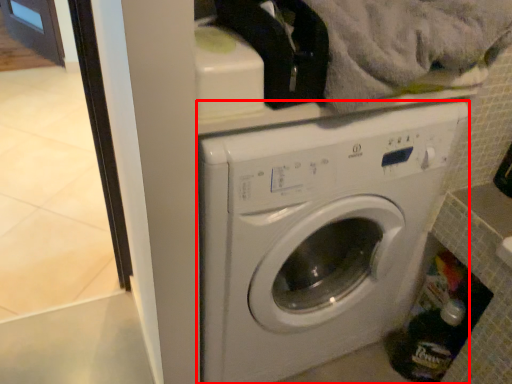
Question: From the image's perspective, where is washing machine (annotated by the red box) located in relation to bottle in the image?

Choices:
 (A) above
 (B) below

Answer: (A)